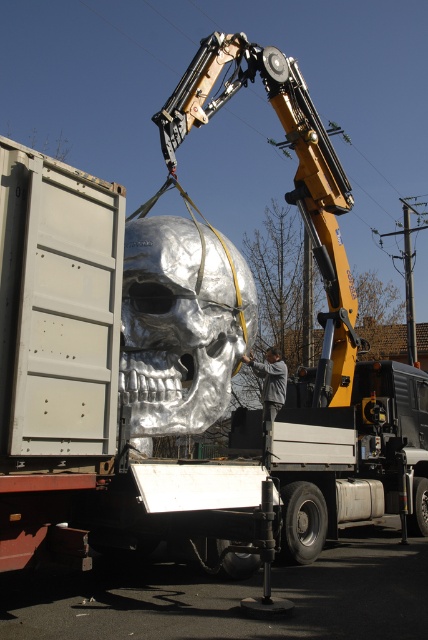
Can you confirm if shiny metallic skull at center is thinner than gray fabric jacket at center?

No.

Who is more distant from viewer, (177, 314) or (246, 360)?

The point (246, 360) is more distant.

Find the location of a particular element. The width and height of the screenshot is (428, 640). shiny metallic skull at center is located at coordinates (180, 324).

In the scene shown: Is silver metallic skull at center shorter than gray fabric jacket at center?

Yes, silver metallic skull at center is shorter than gray fabric jacket at center.

Which is below, silver metallic skull at center or gray fabric jacket at center?

silver metallic skull at center is lower down.

This screenshot has width=428, height=640. Describe the element at coordinates (154, 397) in the screenshot. I see `silver metallic skull at center` at that location.

At what (x,y) coordinates should I click in order to perform the action: click on silver metallic skull at center. Please return your answer as a coordinate pair (x, y). This screenshot has height=640, width=428. Looking at the image, I should click on (154, 397).

Is silver metallic skull at center behind shiny metallic skull at center?

No.

Who is more forward, (412, 436) or (125, 232)?

Positioned in front is point (125, 232).

The image size is (428, 640). I want to click on silver metallic skull at center, so click(154, 397).